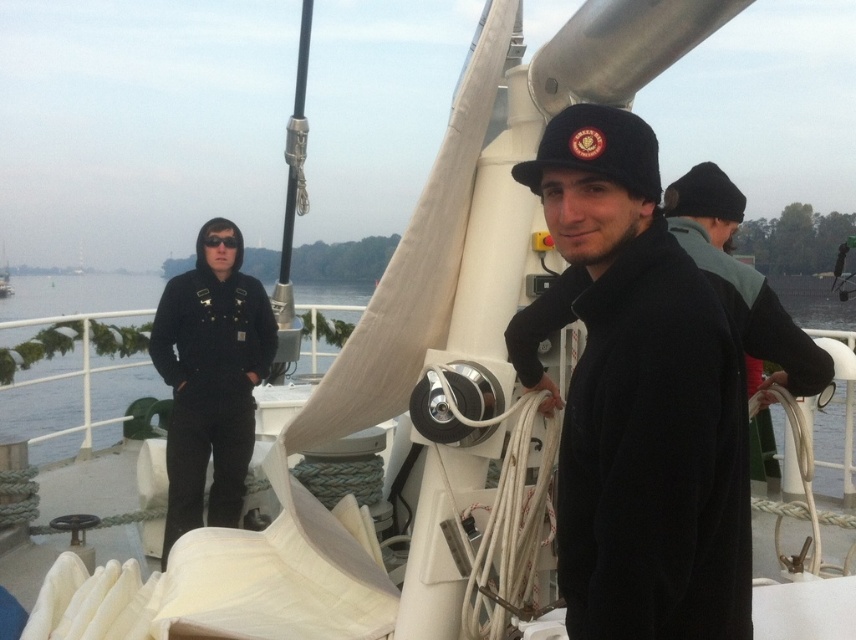
You are a sailor on the boat and need to pass through the area between the black fleece jacket at center and the black fleece jacket at left. Can you walk through this space?

The black fleece jacket at center is in front of the black fleece jacket at left, so there is space between them for you to walk through.

Consider the image. You are a sailor on the boat and need to determine if the black fleece jacket at left is visible above the blue water at center. Based on the scene, can you confirm this?

The black fleece jacket at left is taller than blue water at center, so yes, the jacket is visible above the blue water at center.